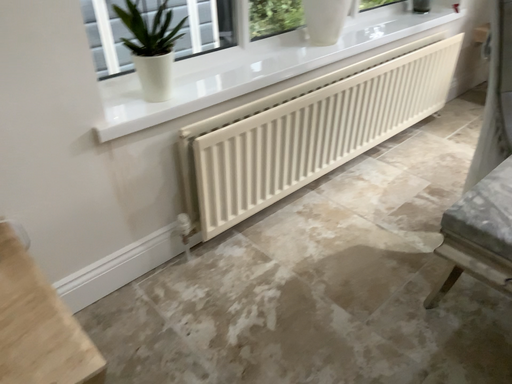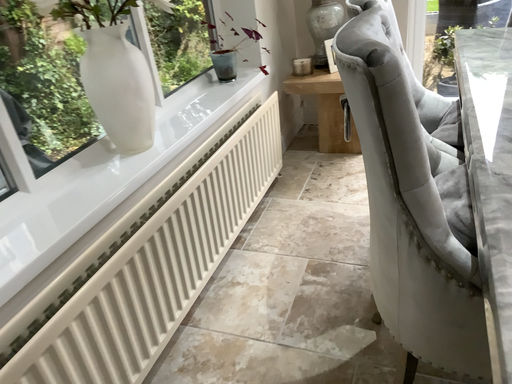
Question: Which way did the camera rotate in the video?

Choices:
 (A) rotated right
 (B) rotated left

Answer: (A)